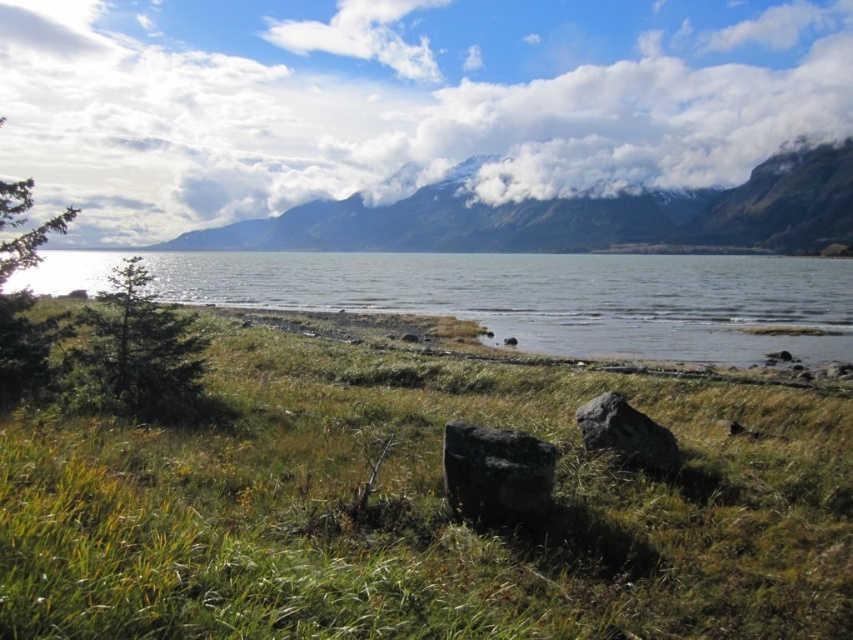
You are standing at the edge of the grassy area in the scene and want to reach the clear water at lower center. Based on the coordinates provided in the description, can you estimate the direction you should walk to reach it?

The clear water at lower center is located at point coordinates, so you should walk towards the lower center direction to reach it.

You are a hiker who wants to cross the lake using the rocks. You have a backpack that requires a minimum width of 30 cm to place. Given the black rough boulder at center and the gray rough rock at center, which one can support your backpack?

The gray rough rock at center is wider than the black rough boulder at center, so the gray rough rock at center can support the backpack as it meets the minimum width requirement.